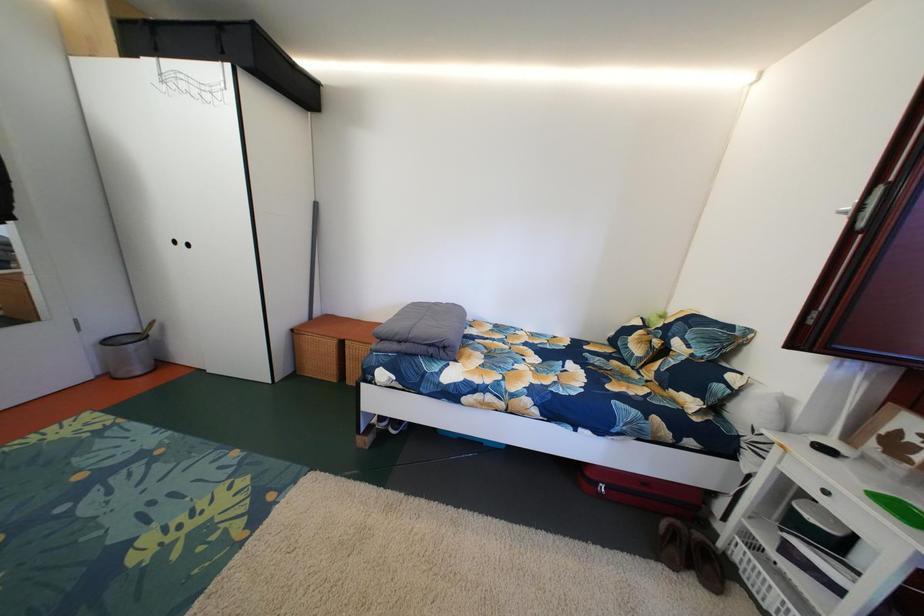
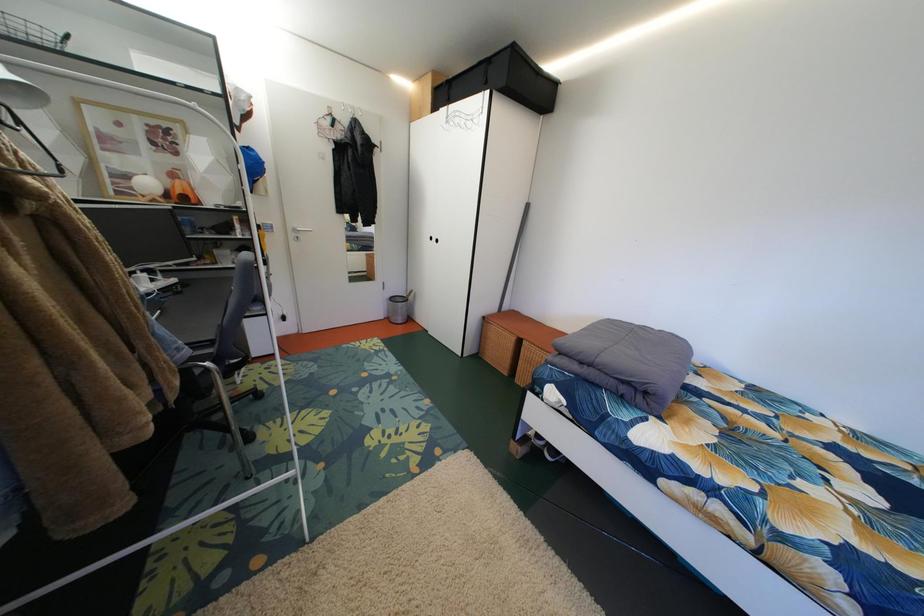
Question: The camera is either moving clockwise (left) or counter-clockwise (right) around the object. The first image is from the beginning of the video and the second image is from the end. Is the camera moving left or right when shooting the video?

Choices:
 (A) Left
 (B) Right

Answer: (B)